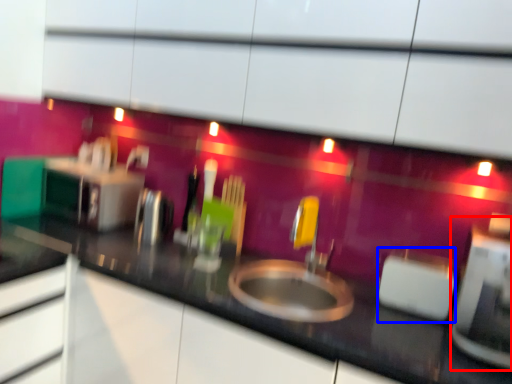
Question: Which object is further to the camera taking this photo, appliance (highlighted by a red box) or appliance (highlighted by a blue box)?

Choices:
 (A) appliance
 (B) appliance

Answer: (B)